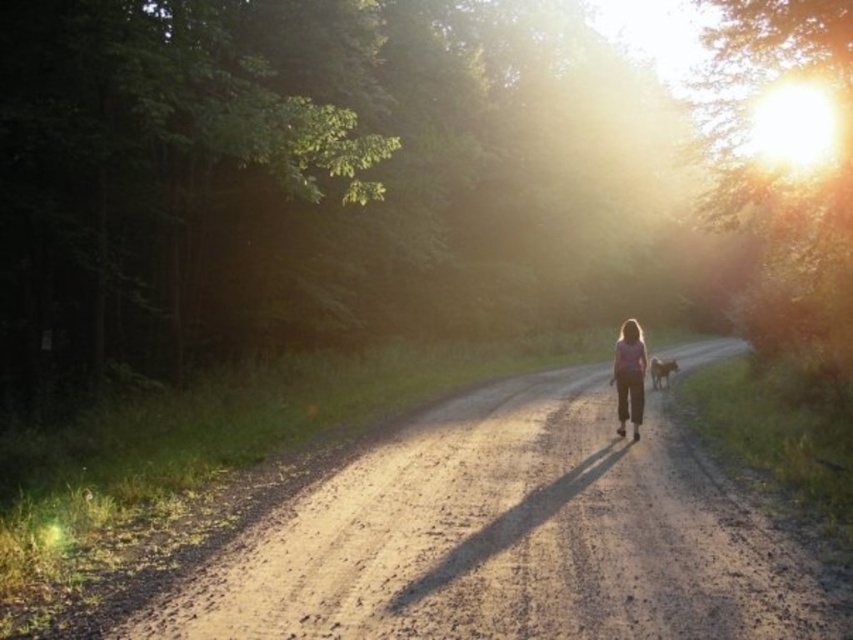
Question: Which of the following is the closest to the observer?

Choices:
 (A) pink fabric girl at center
 (B) dusty gravel road at center

Answer: (B)

Question: Which point is farther to the camera?

Choices:
 (A) pink fabric girl at center
 (B) dusty gravel road at center

Answer: (A)

Question: Is dusty gravel road at center positioned in front of pink fabric girl at center?

Choices:
 (A) no
 (B) yes

Answer: (B)

Question: Does dusty gravel road at center come behind pink fabric girl at center?

Choices:
 (A) no
 (B) yes

Answer: (A)

Question: Which point is closer to the camera?

Choices:
 (A) dusty gravel road at center
 (B) pink fabric girl at center

Answer: (A)

Question: Can you confirm if dusty gravel road at center is positioned above pink fabric girl at center?

Choices:
 (A) yes
 (B) no

Answer: (B)